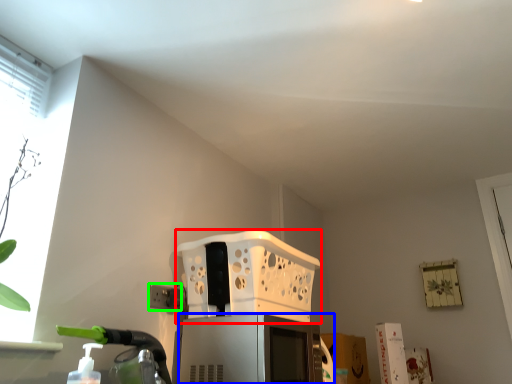
Question: Based on their relative distances, which object is nearer to basket (highlighted by a red box)? Choose from appliance (highlighted by a blue box) and electric outlet (highlighted by a green box).

Choices:
 (A) appliance
 (B) electric outlet

Answer: (A)